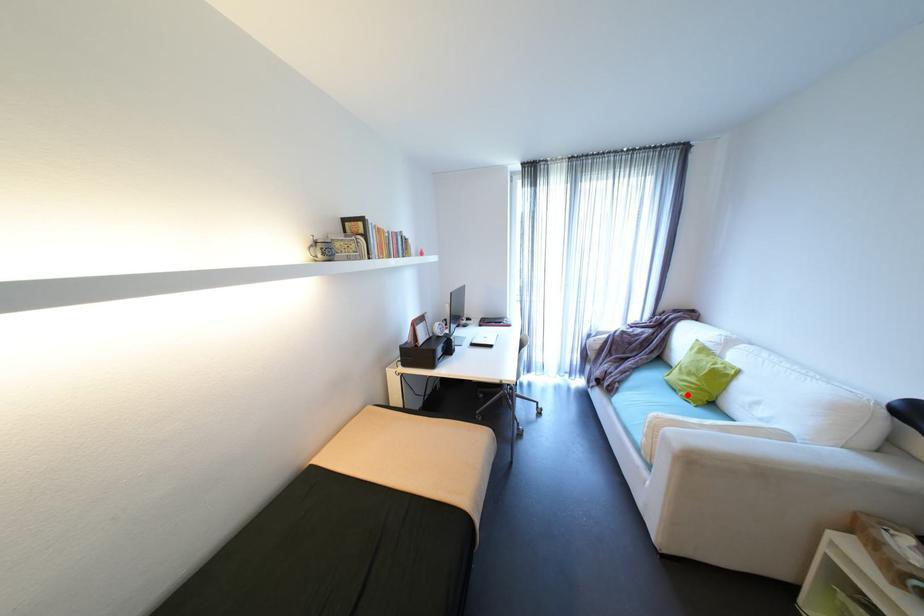
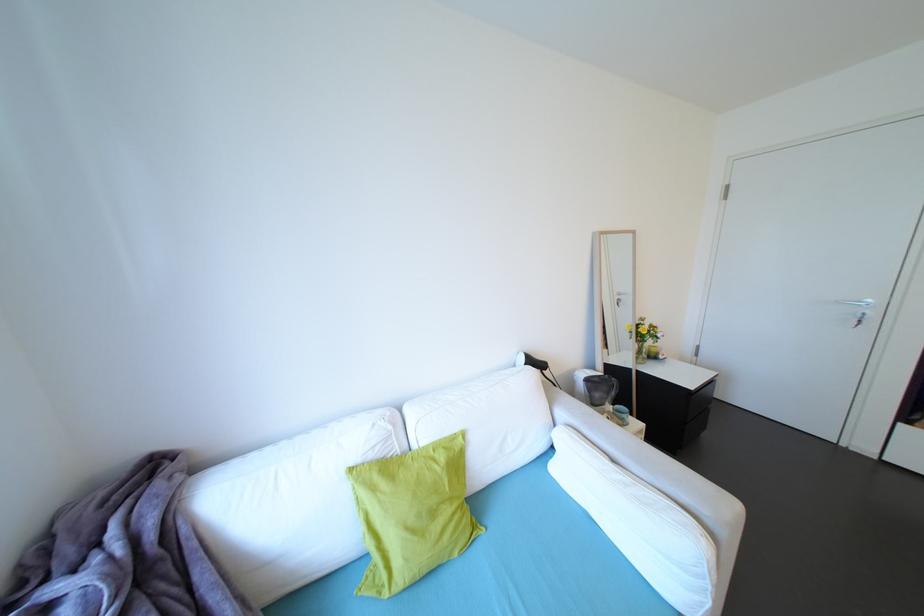
The point at the highlighted location is marked in the first image. Where is the corresponding point in the second image?

(464, 556)